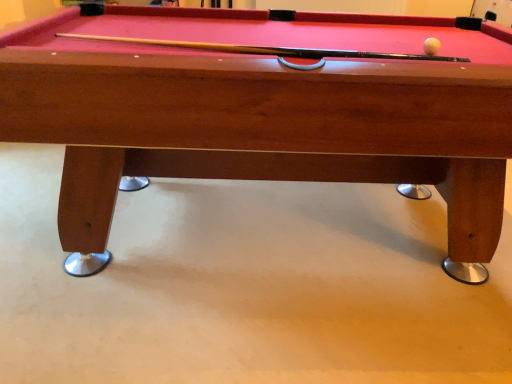
Question: Visually, is wooden billiard table at center positioned to the left or to the right of white glossy ball at upper right?

Choices:
 (A) left
 (B) right

Answer: (A)

Question: From a real-world perspective, is wooden billiard table at center physically located above or below white glossy ball at upper right?

Choices:
 (A) below
 (B) above

Answer: (A)

Question: From the image's perspective, is wooden billiard table at center located above or below white glossy ball at upper right?

Choices:
 (A) above
 (B) below

Answer: (B)

Question: Looking at their shapes, would you say white glossy ball at upper right is wider or thinner than wooden billiard table at center?

Choices:
 (A) wide
 (B) thin

Answer: (B)

Question: From their relative heights in the image, would you say white glossy ball at upper right is taller or shorter than wooden billiard table at center?

Choices:
 (A) short
 (B) tall

Answer: (A)

Question: From a real-world perspective, relative to wooden billiard table at center, is white glossy ball at upper right vertically above or below?

Choices:
 (A) below
 (B) above

Answer: (B)

Question: In the image, is white glossy ball at upper right on the left side or the right side of wooden billiard table at center?

Choices:
 (A) right
 (B) left

Answer: (A)